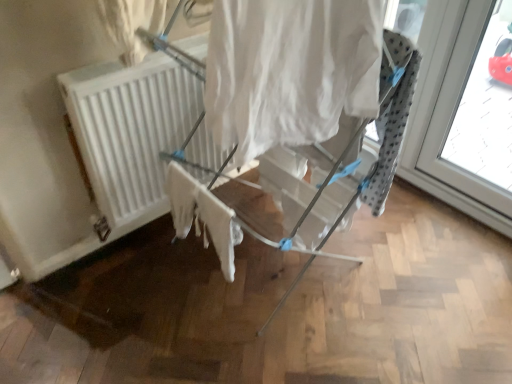
Question: Is white cotton cloth at center positioned far away from white fabric curtain at center?

Choices:
 (A) no
 (B) yes

Answer: (A)

Question: Considering the relative positions of white cotton cloth at center and white fabric curtain at center in the image provided, is white cotton cloth at center to the right of white fabric curtain at center from the viewer's perspective?

Choices:
 (A) no
 (B) yes

Answer: (A)

Question: Is white cotton cloth at center looking in the opposite direction of white fabric curtain at center?

Choices:
 (A) yes
 (B) no

Answer: (B)

Question: Is white fabric curtain at center a part of white cotton cloth at center?

Choices:
 (A) yes
 (B) no

Answer: (B)

Question: Could you tell me if white cotton cloth at center is facing white fabric curtain at center?

Choices:
 (A) yes
 (B) no

Answer: (B)

Question: Is white cotton cloth at center bigger than white fabric curtain at center?

Choices:
 (A) yes
 (B) no

Answer: (B)

Question: From a real-world perspective, is white cotton cloth at center below transparent glass window at right?

Choices:
 (A) yes
 (B) no

Answer: (A)

Question: From the image's perspective, does white cotton cloth at center appear higher than transparent glass window at right?

Choices:
 (A) no
 (B) yes

Answer: (A)

Question: Is the position of white cotton cloth at center less distant than that of transparent glass window at right?

Choices:
 (A) yes
 (B) no

Answer: (A)

Question: Considering the relative positions of white cotton cloth at center and transparent glass window at right in the image provided, is white cotton cloth at center to the left of transparent glass window at right from the viewer's perspective?

Choices:
 (A) yes
 (B) no

Answer: (A)

Question: From the image's perspective, is white cotton cloth at center below transparent glass window at right?

Choices:
 (A) yes
 (B) no

Answer: (A)

Question: Can you confirm if white cotton cloth at center is shorter than transparent glass window at right?

Choices:
 (A) no
 (B) yes

Answer: (B)

Question: Is the depth of white cotton cloth at center greater than that of white matte radiator at center?

Choices:
 (A) no
 (B) yes

Answer: (A)